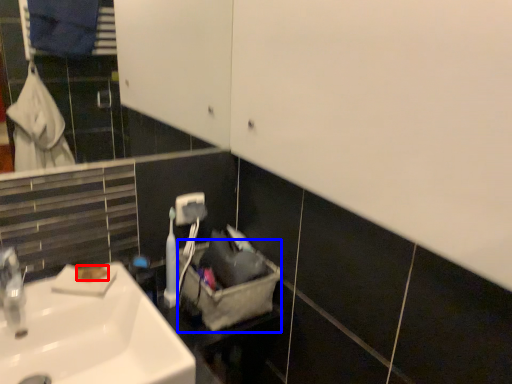
Question: Which point is further to the camera, soap (highlighted by a red box) or laundry basket (highlighted by a blue box)?

Choices:
 (A) soap
 (B) laundry basket

Answer: (B)